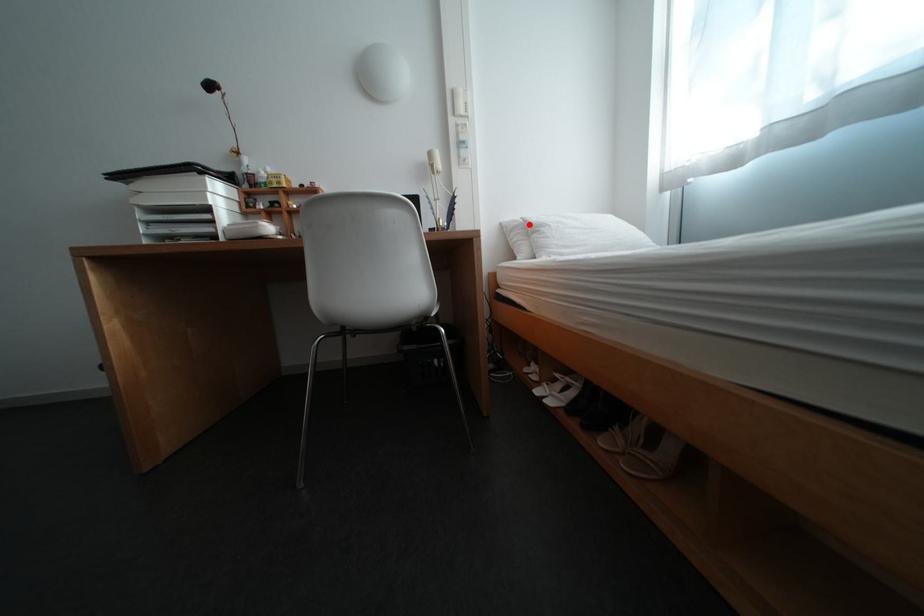
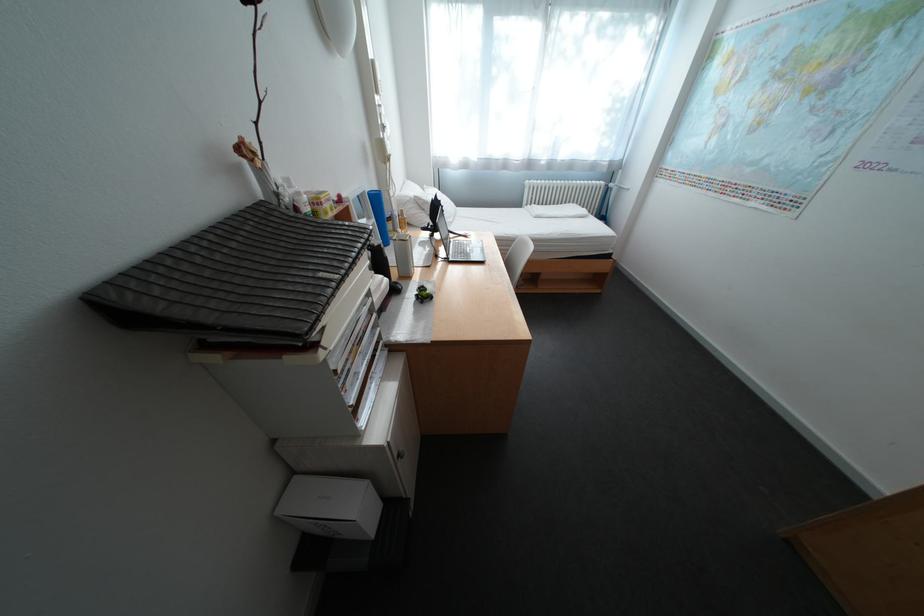
Where in the second image is the point corresponding to the highlighted location from the first image?

(420, 200)